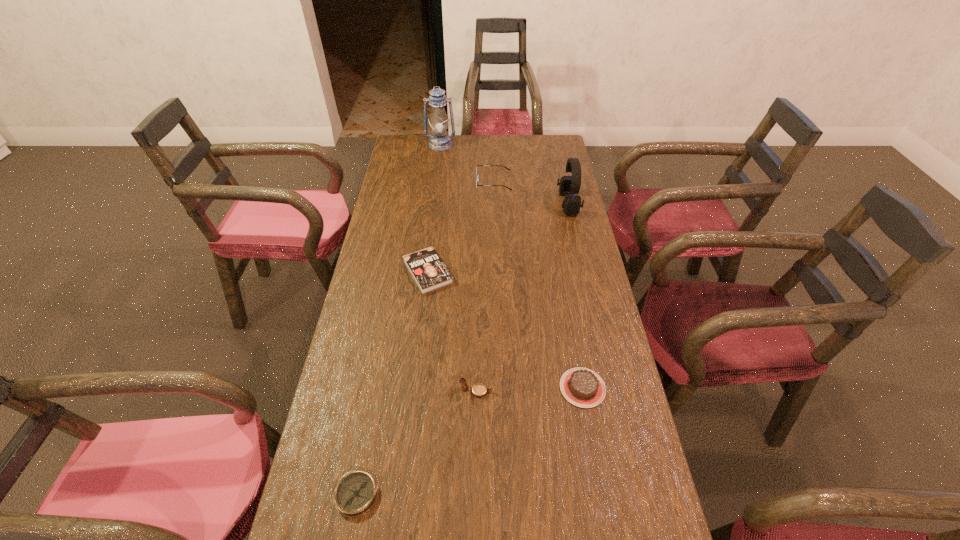
Where is `lantern`? lantern is located at coordinates (439, 141).

Where is `the tallest object`? the tallest object is located at coordinates (439, 141).

You are a GUI agent. You are given a task and a screenshot of the screen. Output one action in this format:
    pyautogui.click(x=<x>, y=<y>)
    Task: Click on the sixth shortest object
    
    Given the screenshot: What is the action you would take?
    pyautogui.click(x=569, y=185)

Where is `spectacles`? spectacles is located at coordinates (477, 165).

You are a GUI agent. You are given a task and a screenshot of the screen. Output one action in this format:
    pyautogui.click(x=<x>, y=<y>)
    Task: Click on the taller compass
    
    Given the screenshot: What is the action you would take?
    pyautogui.click(x=479, y=390)

Locate an element on the screen. the farther compass is located at coordinates (479, 390).

This screenshot has width=960, height=540. In order to click on the fifth tallest object in this screenshot , I will do `click(582, 387)`.

Image resolution: width=960 pixels, height=540 pixels. Find the location of `the sixth tallest object`. the sixth tallest object is located at coordinates (428, 270).

Where is `the fourth nearest object`? Image resolution: width=960 pixels, height=540 pixels. the fourth nearest object is located at coordinates (428, 270).

Image resolution: width=960 pixels, height=540 pixels. Find the location of `the nearest object`. the nearest object is located at coordinates (x=356, y=492).